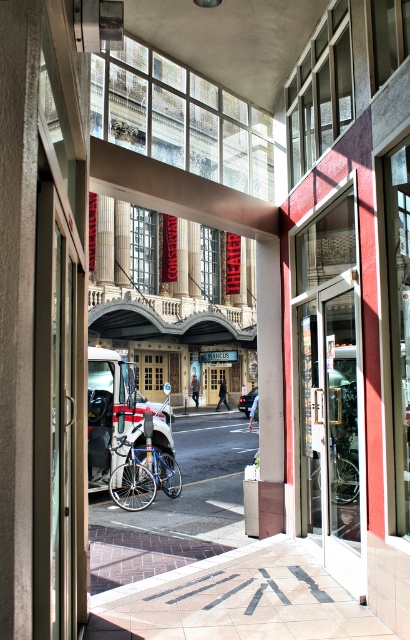
Question: Based on their relative distances, which object is farther from the metallic silver car at center?

Choices:
 (A) metallic pavement at center
 (B) silver metallic bicycle at center
 (C) black glossy car at center
 (D) blue metallic bicycle at center

Answer: (C)

Question: Can you confirm if white matte car at center is wider than blue metallic bicycle at center?

Choices:
 (A) yes
 (B) no

Answer: (A)

Question: Considering the relative positions of metallic silver car at center and black glossy car at center in the image provided, where is metallic silver car at center located with respect to black glossy car at center?

Choices:
 (A) right
 (B) left

Answer: (B)

Question: Which of the following is the farthest from the observer?

Choices:
 (A) (163, 531)
 (B) (166, 438)
 (C) (248, 406)

Answer: (C)

Question: Which object appears farthest from the camera in this image?

Choices:
 (A) white matte car at center
 (B) silver metallic bicycle at center

Answer: (A)

Question: Does white matte car at center appear on the left side of black glossy car at center?

Choices:
 (A) yes
 (B) no

Answer: (A)